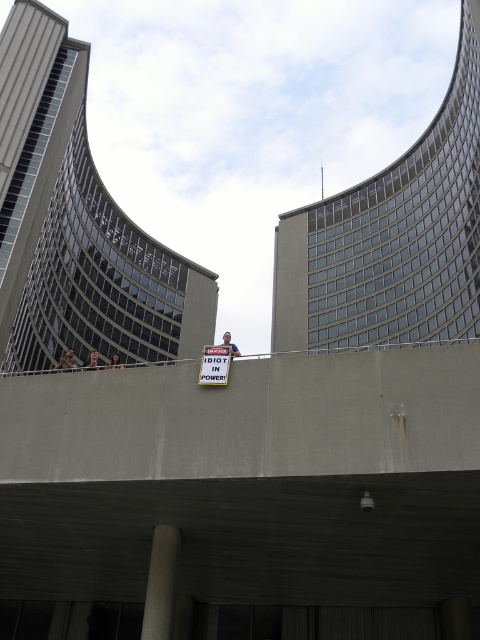
Question: Can you confirm if white matte pillar at lower center is thinner than white plastic sign at center?

Choices:
 (A) no
 (B) yes

Answer: (B)

Question: Which point is farther from the camera taking this photo?

Choices:
 (A) (149, 611)
 (B) (223, 380)

Answer: (A)

Question: Can you confirm if white matte pillar at lower center is positioned below white plastic sign at center?

Choices:
 (A) yes
 (B) no

Answer: (A)

Question: Which of the following is the closest to the observer?

Choices:
 (A) (165, 602)
 (B) (201, 381)

Answer: (B)

Question: Is the position of white matte pillar at lower center more distant than that of white plastic sign at center?

Choices:
 (A) yes
 (B) no

Answer: (B)